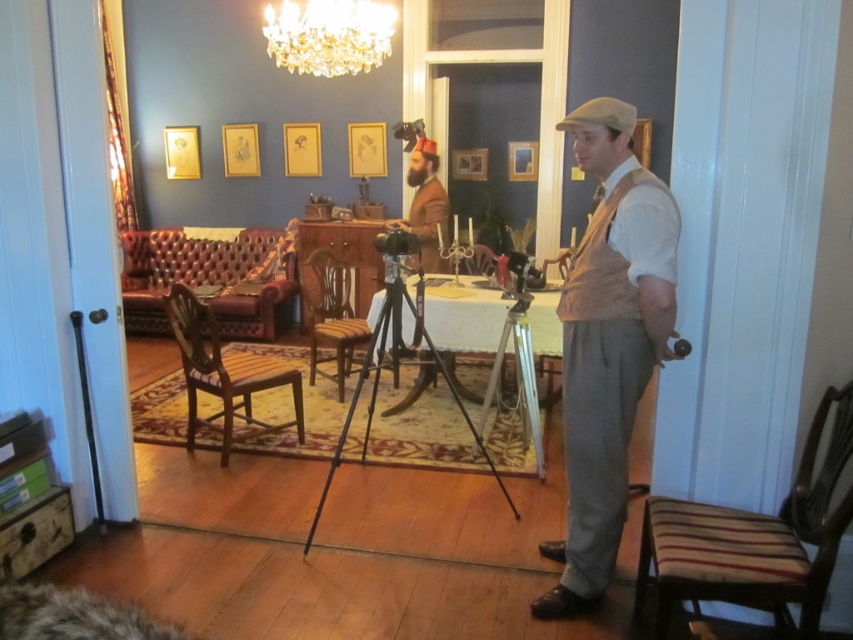
At what (x,y) coordinates should I click in order to perform the action: click on striped fabric stool at lower right. Please return your answer as a coordinate pair (x, y). Image resolution: width=853 pixels, height=640 pixels. Looking at the image, I should click on (724, 563).

What do you see at coordinates (724, 563) in the screenshot?
I see `striped fabric stool at lower right` at bounding box center [724, 563].

Which is behind, point (751, 532) or point (409, 186)?

Point (409, 186)

At what (x,y) coordinates should I click in order to perform the action: click on striped fabric stool at lower right. Please return your answer as a coordinate pair (x, y). Looking at the image, I should click on (724, 563).

Can you confirm if crystal glass chandelier at upper center is bigger than brown woolen suit at center?

Actually, crystal glass chandelier at upper center might be smaller than brown woolen suit at center.

Who is taller, crystal glass chandelier at upper center or brown woolen suit at center?

Standing taller between the two is brown woolen suit at center.

Does point (292, 68) come in front of point (412, 147)?

Yes, it is in front of point (412, 147).

Find the location of a particular element. crystal glass chandelier at upper center is located at coordinates (329, 35).

Which is in front, point (546, 609) or point (373, 337)?

Point (546, 609) is in front.

Does light brown fabric vest at center appear under black metal tripod at center?

Incorrect, light brown fabric vest at center is not positioned below black metal tripod at center.

Is point (604, 280) more distant than point (347, 413)?

No, (604, 280) is closer to viewer.

Locate an element on the screen. This screenshot has height=640, width=853. light brown fabric vest at center is located at coordinates (607, 344).